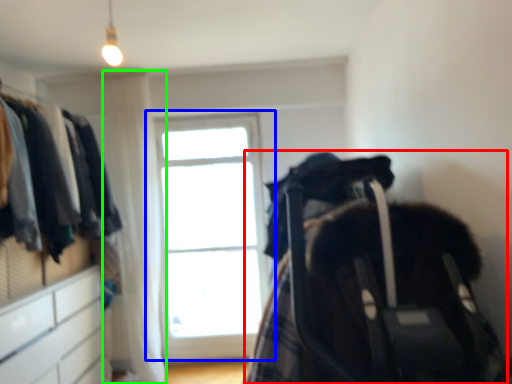
Question: Which is farther away from baby carriage (highlighted by a red box)? window (highlighted by a blue box) or curtain (highlighted by a green box)?

Choices:
 (A) window
 (B) curtain

Answer: (A)